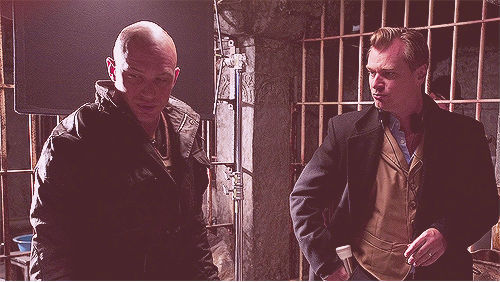
Locate an element on the screen. blue bowl is located at coordinates (26, 243).